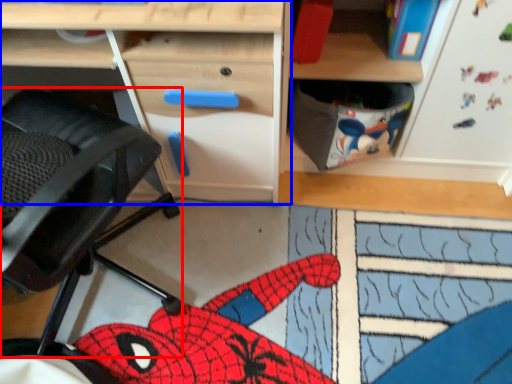
Question: Among these objects, which one is nearest to the camera, swivel chair (highlighted by a red box) or desk (highlighted by a blue box)?

Choices:
 (A) swivel chair
 (B) desk

Answer: (A)